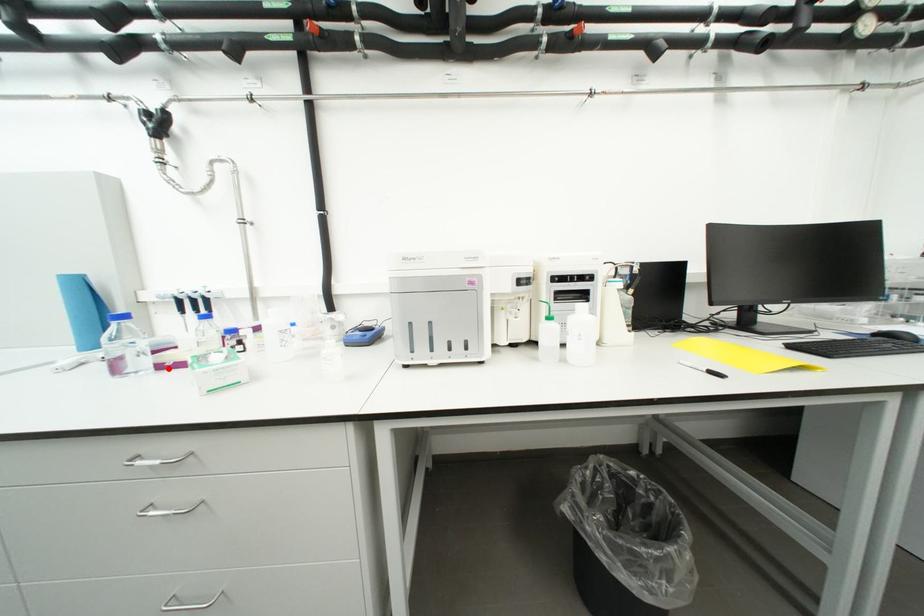
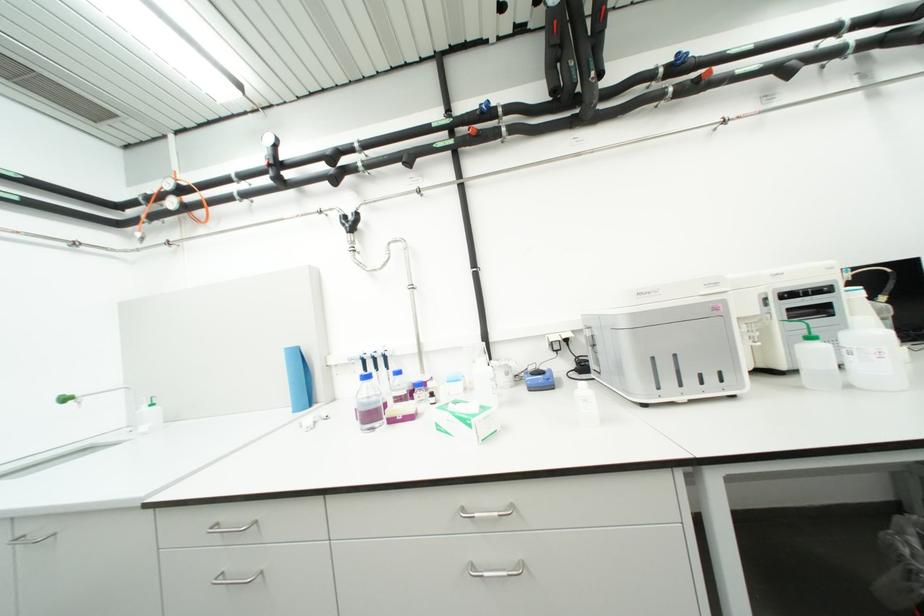
Where in the second image is the point corresponding to the highlighted location from the first image?

(399, 422)